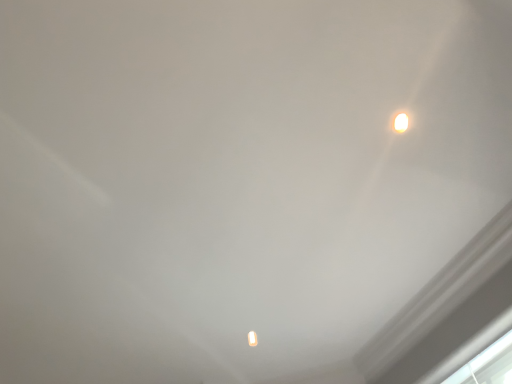
Question: From the image's perspective, is transparent glass window at lower right above white glossy lamp at upper right?

Choices:
 (A) no
 (B) yes

Answer: (A)

Question: From a real-world perspective, is transparent glass window at lower right on top of white glossy lamp at upper right?

Choices:
 (A) no
 (B) yes

Answer: (A)

Question: Considering the relative sizes of transparent glass window at lower right and white glossy lamp at upper right in the image provided, is transparent glass window at lower right taller than white glossy lamp at upper right?

Choices:
 (A) yes
 (B) no

Answer: (A)

Question: From the image's perspective, is transparent glass window at lower right below white glossy lamp at upper right?

Choices:
 (A) no
 (B) yes

Answer: (B)

Question: Are transparent glass window at lower right and white glossy lamp at upper right far apart?

Choices:
 (A) yes
 (B) no

Answer: (A)

Question: Is transparent glass window at lower right positioned with its back to white glossy lamp at upper right?

Choices:
 (A) yes
 (B) no

Answer: (B)

Question: Is white glossy lamp at upper right taller than transparent glass window at lower right?

Choices:
 (A) yes
 (B) no

Answer: (B)

Question: Considering the relative sizes of white glossy lamp at upper right and transparent glass window at lower right in the image provided, is white glossy lamp at upper right bigger than transparent glass window at lower right?

Choices:
 (A) no
 (B) yes

Answer: (A)

Question: Is white glossy lamp at upper right at the right side of transparent glass window at lower right?

Choices:
 (A) no
 (B) yes

Answer: (A)

Question: Is white glossy lamp at upper right not close to transparent glass window at lower right?

Choices:
 (A) yes
 (B) no

Answer: (A)

Question: Is transparent glass window at lower right located within white glossy lamp at upper right?

Choices:
 (A) no
 (B) yes

Answer: (A)

Question: Is white glossy lamp at upper right wider than transparent glass window at lower right?

Choices:
 (A) yes
 (B) no

Answer: (B)

Question: Looking at the image, does transparent glass window at lower right seem bigger or smaller compared to white glossy lamp at upper right?

Choices:
 (A) small
 (B) big

Answer: (B)